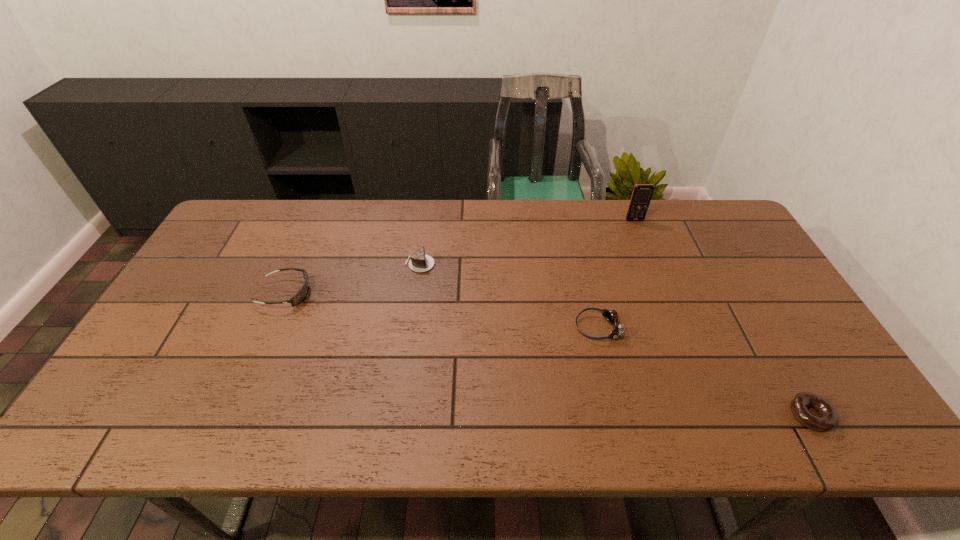
This screenshot has height=540, width=960. In order to click on the farthest object in this screenshot , I will do `click(642, 193)`.

Locate an element on the screen. The width and height of the screenshot is (960, 540). the tallest object is located at coordinates (642, 193).

The image size is (960, 540). I want to click on the leftmost object, so click(x=302, y=293).

Where is `the farther goggles`? The height and width of the screenshot is (540, 960). the farther goggles is located at coordinates (302, 293).

Image resolution: width=960 pixels, height=540 pixels. I want to click on the second farthest object, so click(419, 262).

At what (x,y) coordinates should I click in order to perform the action: click on the fourth object from right to left. Please return your answer as a coordinate pair (x, y). The width and height of the screenshot is (960, 540). Looking at the image, I should click on (419, 262).

This screenshot has width=960, height=540. In order to click on the nearer goggles in this screenshot , I will do `click(611, 316)`.

The image size is (960, 540). I want to click on the third object from right to left, so click(611, 316).

Where is `the nearest object`? This screenshot has height=540, width=960. the nearest object is located at coordinates (828, 419).

Image resolution: width=960 pixels, height=540 pixels. Identify the location of the rightmost object. (828, 419).